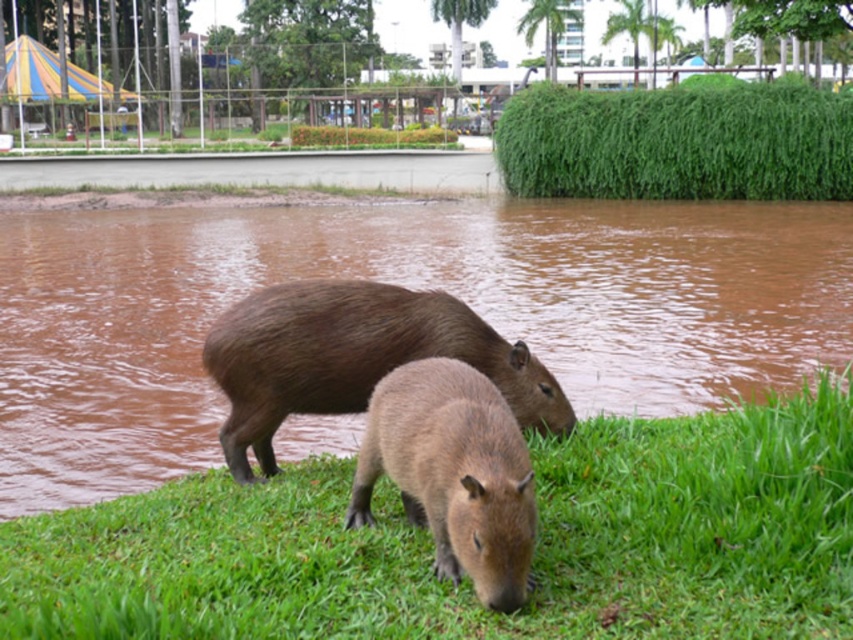
Who is more distant from viewer, (186,221) or (244,394)?

The point (186,221) is more distant.

Measure the distance between brown fur capybara at lower center and brown furry capybara at center.

brown fur capybara at lower center is 20.69 feet from brown furry capybara at center.

What do you see at coordinates (405, 284) in the screenshot? I see `brown fur capybara at lower center` at bounding box center [405, 284].

Locate an element on the screen. brown fur capybara at lower center is located at coordinates (405, 284).

Consider the image. Who is positioned more to the left, green leafy grass at upper center or brown furry capybara at center?

brown furry capybara at center

Can you confirm if green leafy grass at upper center is wider than brown furry capybara at center?

Yes.

Does point (602, 129) lie in front of point (367, 298)?

No, it is not.

The image size is (853, 640). I want to click on green leafy grass at upper center, so click(677, 141).

Who is shorter, brown fur capybara at lower center or brown furry capybara at lower center?

brown furry capybara at lower center is shorter.

Looking at this image, does brown fur capybara at lower center have a larger size compared to brown furry capybara at lower center?

Yes.

Is point (598, 401) closer to camera compared to point (512, 486)?

No, it is behind (512, 486).

Find the location of a particular element. brown fur capybara at lower center is located at coordinates (405, 284).